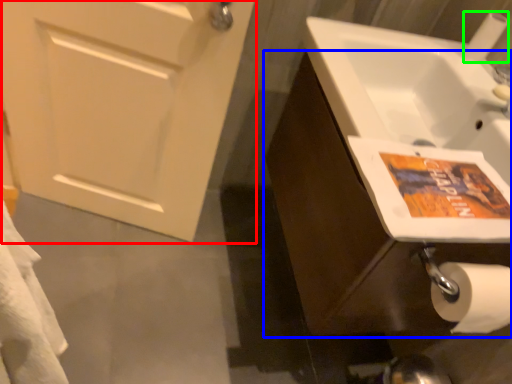
Question: Which is nearer to the door (highlighted by a red box)? bathroom cabinet (highlighted by a blue box) or toilet paper (highlighted by a green box).

Choices:
 (A) bathroom cabinet
 (B) toilet paper

Answer: (A)